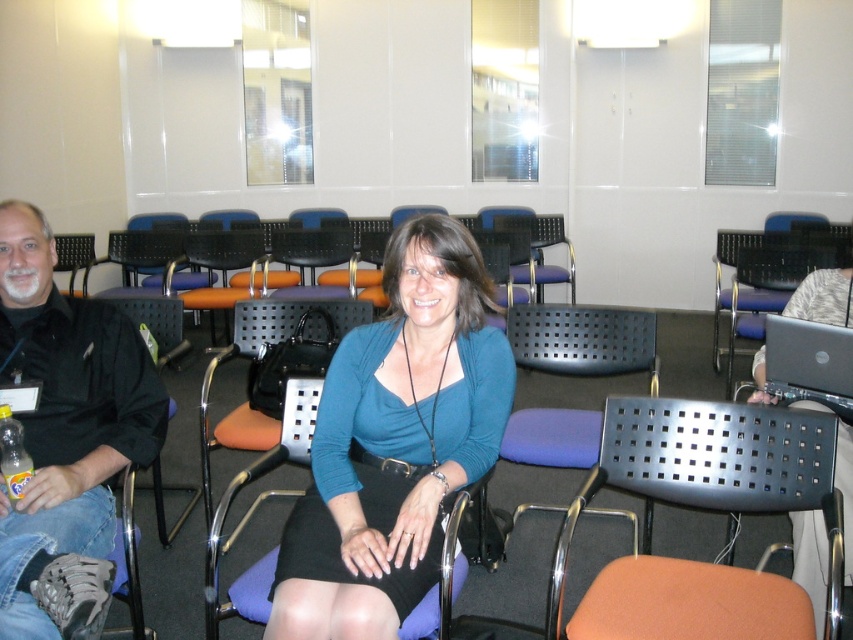
Between purple fabric chair at center and black glossy laptop at right, which one is positioned lower?

purple fabric chair at center is below.

Is purple fabric chair at center smaller than black glossy laptop at right?

No, purple fabric chair at center is not smaller than black glossy laptop at right.

Between point (305, 448) and point (767, 330), which one is positioned in front?

Point (305, 448) is more forward.

This screenshot has height=640, width=853. Identify the location of purple fabric chair at center. click(256, 509).

Can you confirm if black perforated chair at center is positioned below black glossy laptop at right?

Yes, black perforated chair at center is below black glossy laptop at right.

Who is positioned more to the right, black perforated chair at center or black glossy laptop at right?

black glossy laptop at right

Who is more forward, (642, 476) or (833, 368)?

Point (642, 476) is more forward.

Locate an element on the screen. Image resolution: width=853 pixels, height=640 pixels. black perforated chair at center is located at coordinates (708, 508).

Which is below, purple fabric chair at center or black plastic laptop at upper right?

purple fabric chair at center is below.

Between purple fabric chair at center and black plastic laptop at upper right, which one appears on the right side from the viewer's perspective?

black plastic laptop at upper right is more to the right.

Identify the location of purple fabric chair at center. The width and height of the screenshot is (853, 640). (256, 509).

Locate an element on the screen. The image size is (853, 640). purple fabric chair at center is located at coordinates (256, 509).